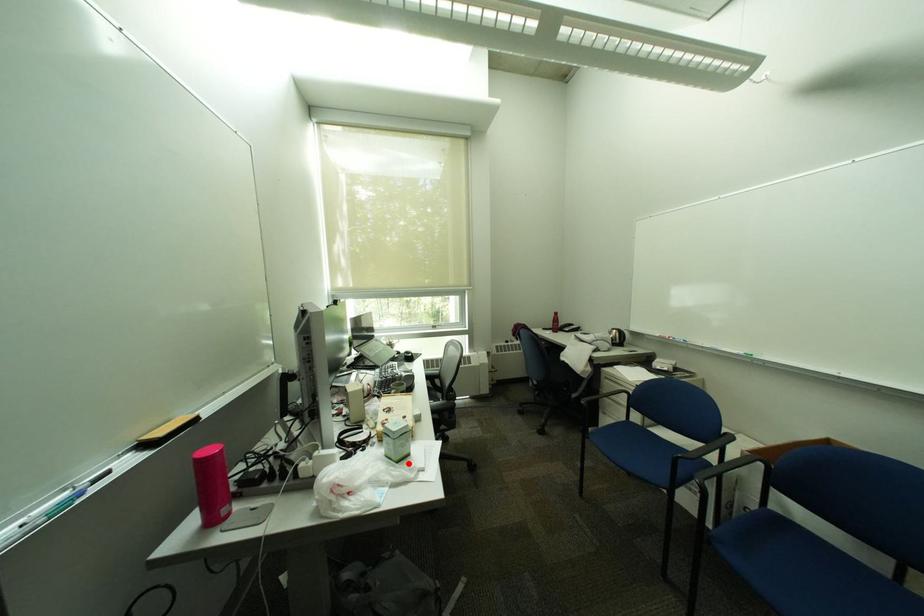
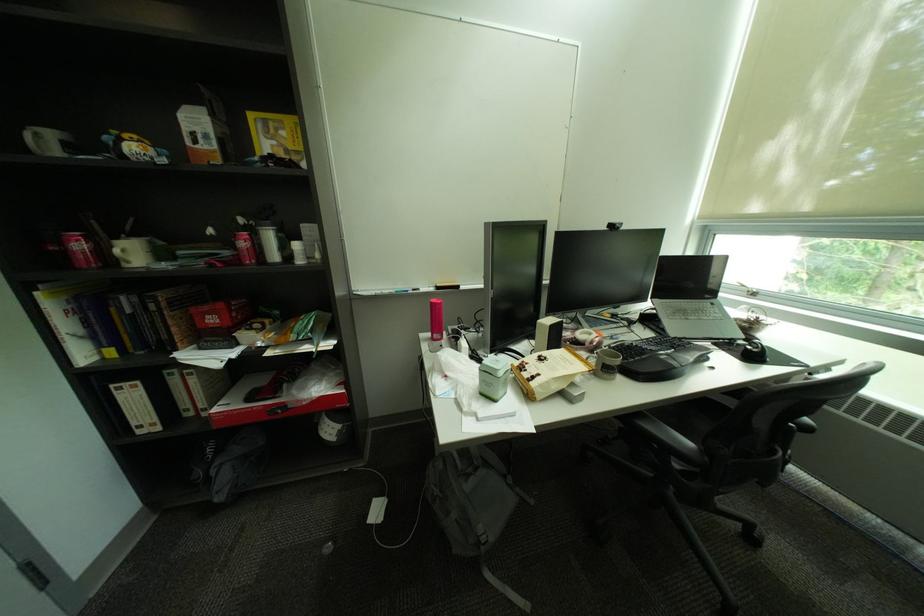
In the second image, find the point that corresponds to the highlighted location in the first image.

(492, 395)